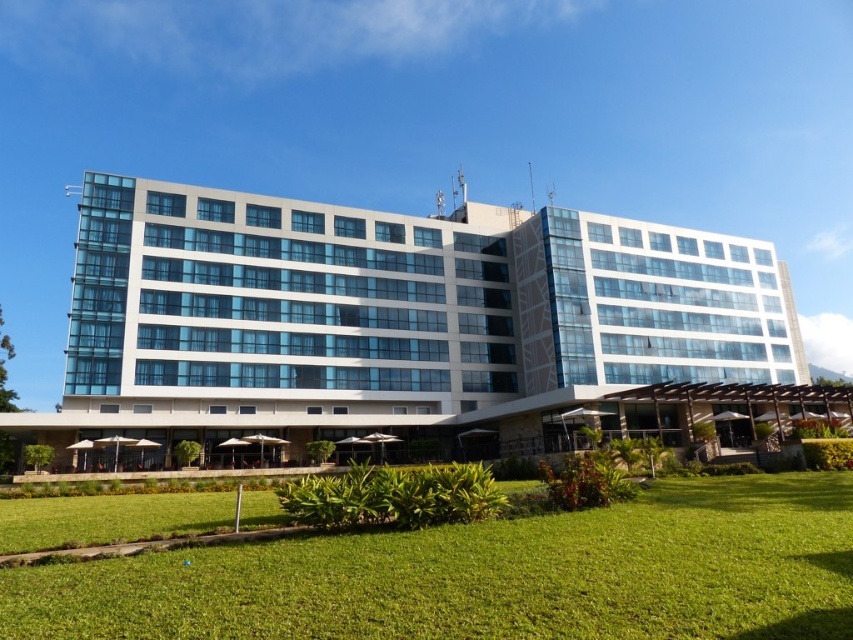
You are a delivery drone with a maximum flight range of 30 meters. You need to deliver a package to the white glass building at center from the green grass at lower center. Can you complete the delivery without needing to recharge?

The distance between the white glass building at center and the green grass at lower center is 27.91 meters, which is within your 30 meter range. Yes, you can complete the delivery without needing to recharge.

You are standing at the entrance of the white glass building at center. Which direction should you face to see the tropical plants and shrubs along the perimeter?

Since the tropical plants and shrubs are arranged along the perimeter in front of the white glass building at center, you should face forward to see them.